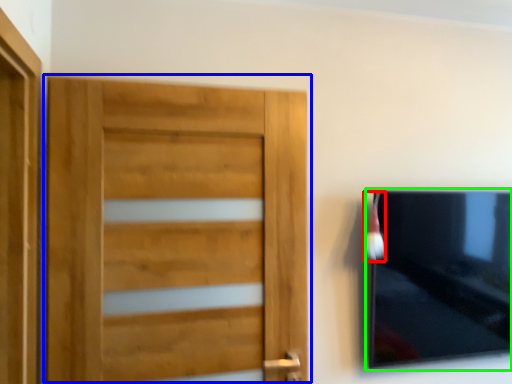
Question: Estimate the real-world distances between objects in this image. Which object is closer to brush (highlighted by a red box), door (highlighted by a blue box) or picture frame (highlighted by a green box)?

Choices:
 (A) door
 (B) picture frame

Answer: (B)